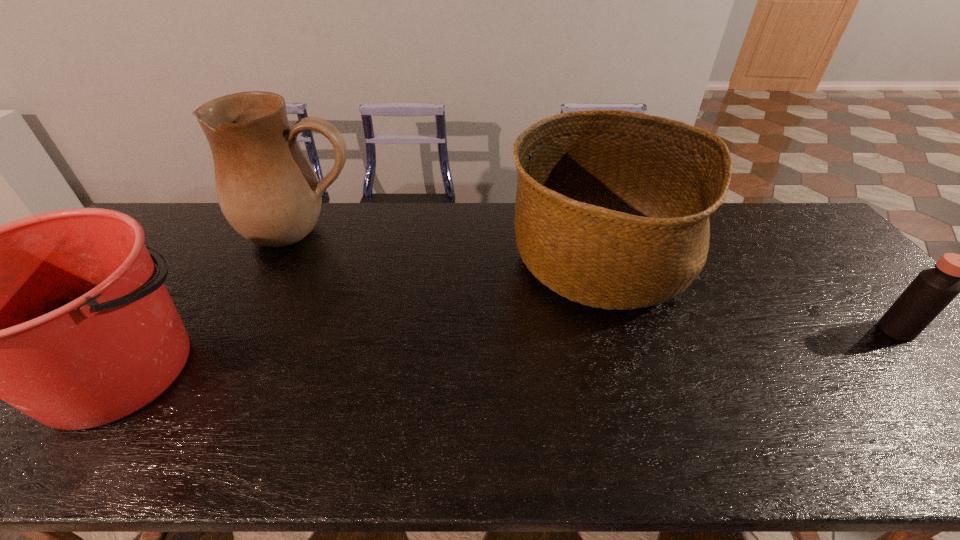
Identify the location of vacant position in the image that satisfies the following two spatial constraints: 1. at the spout of the rightmost object; 2. on the left side of the cream pitcher. The image size is (960, 540). (252, 330).